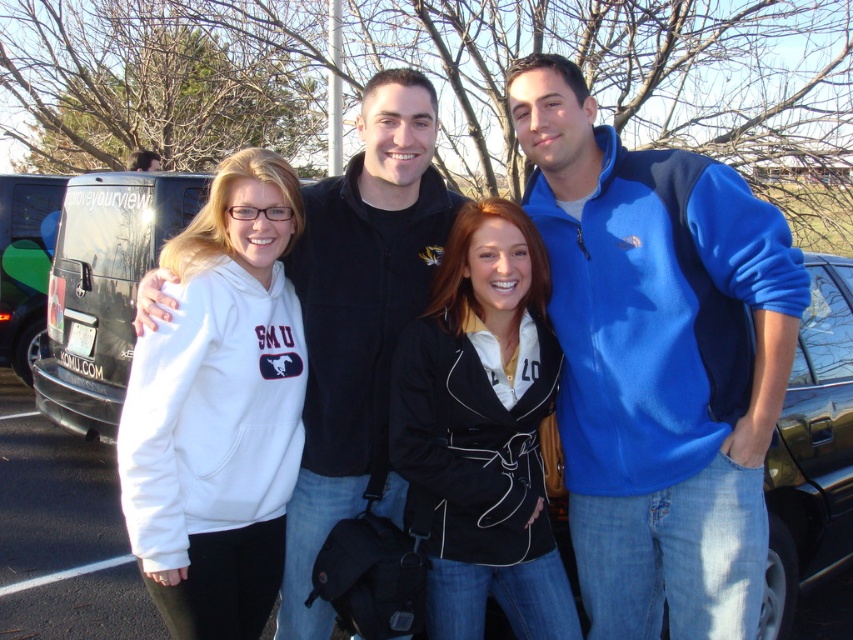
Question: Considering the relative positions of blue fleece jacket at right and black leather jacket at center in the image provided, where is blue fleece jacket at right located with respect to black leather jacket at center?

Choices:
 (A) right
 (B) left

Answer: (A)

Question: Based on their relative distances, which object is nearer to the blue fleece jacket at right?

Choices:
 (A) matte black hoodie at upper left
 (B) green matte van at left

Answer: (B)

Question: Is white fleece hoodie at left positioned behind black leather jacket at center?

Choices:
 (A) no
 (B) yes

Answer: (A)

Question: Is black fleece jacket at center bigger than black glossy car at right?

Choices:
 (A) no
 (B) yes

Answer: (A)

Question: Among these points, which one is nearest to the camera?

Choices:
 (A) (33, 192)
 (B) (386, 320)
 (C) (473, 328)

Answer: (C)

Question: Which point is closer to the camera?

Choices:
 (A) blue fleece jacket at right
 (B) white fleece hoodie at left
 (C) black glossy car at right
 (D) black leather jacket at center

Answer: (B)